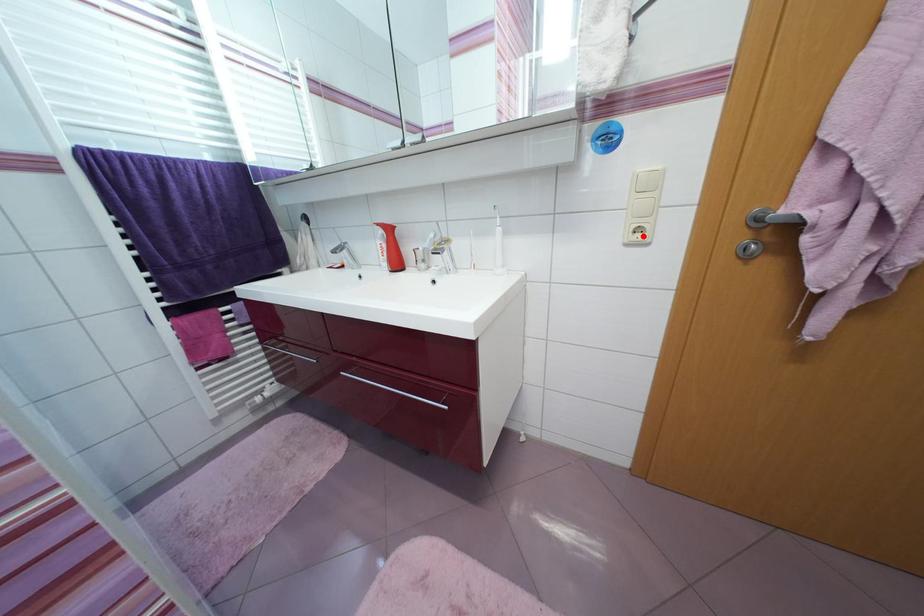
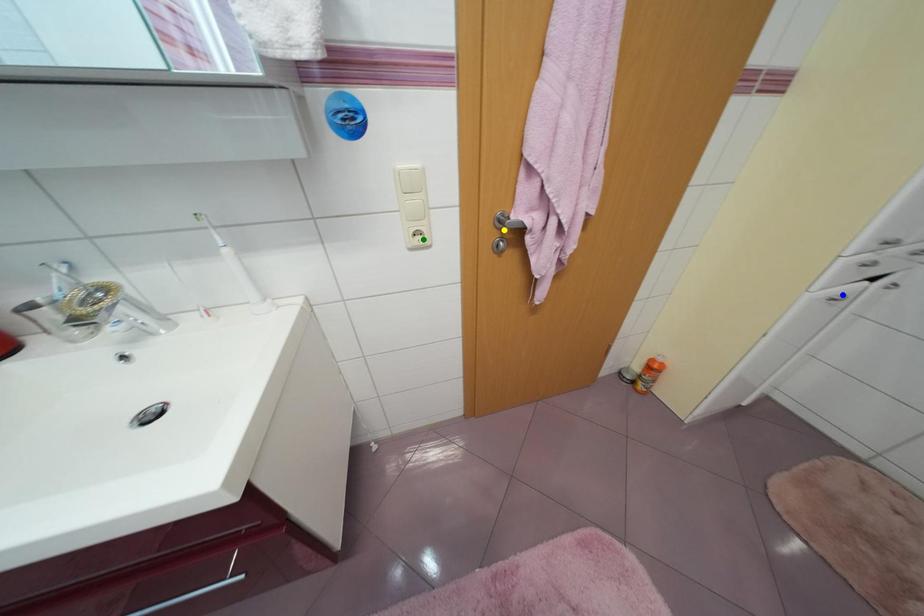
Question: I am providing you with two images of the same scene from different viewpoints. A red point is marked on the first image. You are given multiple points on the second image. In image 2, which mark is for the same physical point as the one in image 1?

Choices:
 (A) yellow point
 (B) blue point
 (C) green point

Answer: (C)